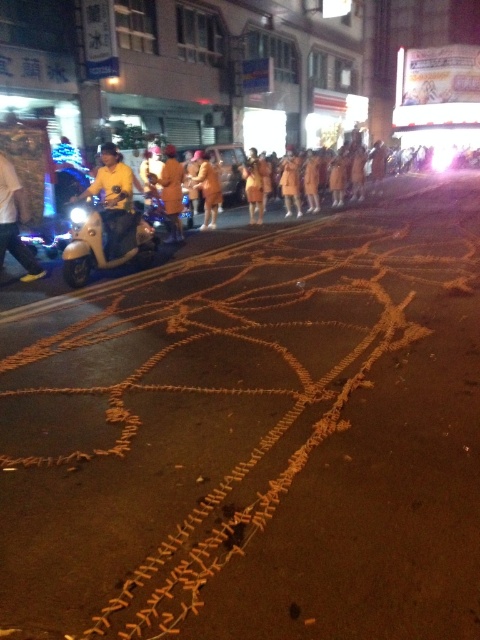
Question: Is yellow matte uniform at center bigger than orange fabric at center?

Choices:
 (A) yes
 (B) no

Answer: (B)

Question: Is matte silver scooter at left further to the viewer compared to yellow matte scooter at left?

Choices:
 (A) yes
 (B) no

Answer: (B)

Question: Which of these objects is positioned closest to the yellow matte scooter at left?

Choices:
 (A) matte silver scooter at left
 (B) orange fabric at center
 (C) yellow fabric person at left

Answer: (A)

Question: Which point is closer to the camera taking this photo?

Choices:
 (A) (180, 240)
 (B) (33, 266)
 (C) (110, 218)

Answer: (C)

Question: Does yellow fabric person at left come behind yellow matte uniform at center?

Choices:
 (A) no
 (B) yes

Answer: (A)

Question: Which object is the closest to the yellow matte scooter at left?

Choices:
 (A) yellow matte uniform at center
 (B) yellow fabric person at left

Answer: (B)